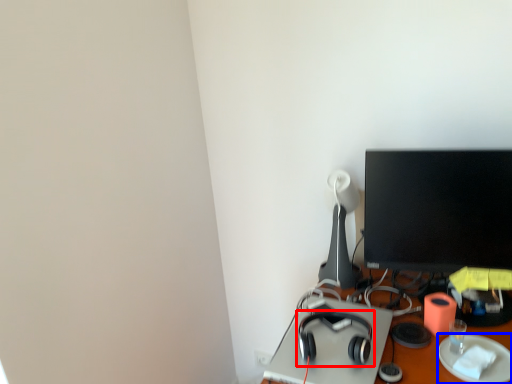
Question: Which point is closer to the camera, headphones (highlighted by a red box) or paper plate (highlighted by a blue box)?

Choices:
 (A) headphones
 (B) paper plate

Answer: (B)